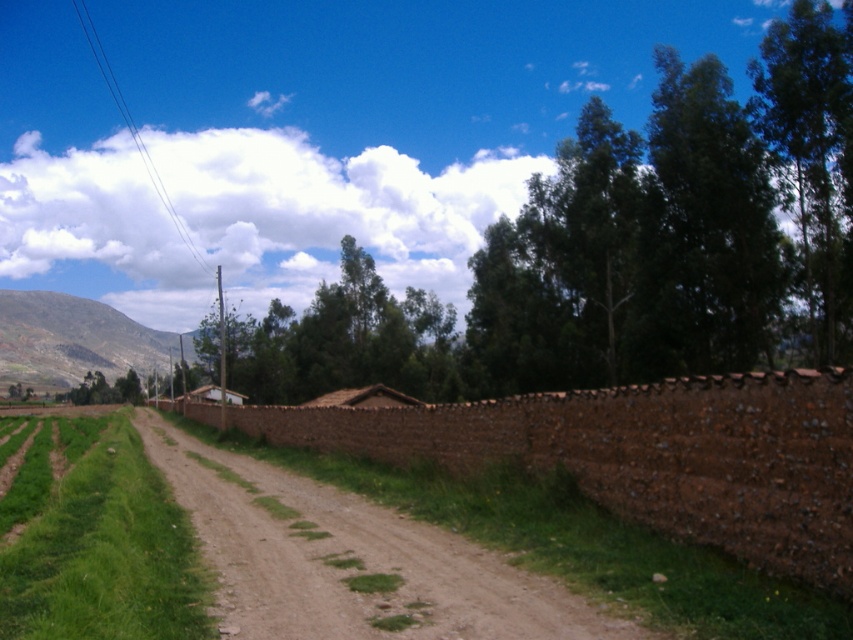
Question: Which point is farther to the camera?

Choices:
 (A) brown stone wall at center
 (B) green leafy tree at upper center

Answer: (B)

Question: Can you confirm if green leafy tree at upper center is bigger than brown stone wall at center?

Choices:
 (A) yes
 (B) no

Answer: (A)

Question: Does green leafy tree at upper center lie in front of brown stone wall at center?

Choices:
 (A) no
 (B) yes

Answer: (A)

Question: Does green leafy tree at upper center appear under brown stone wall at center?

Choices:
 (A) no
 (B) yes

Answer: (A)

Question: Which of the following is the farthest from the observer?

Choices:
 (A) (310, 323)
 (B) (399, 417)

Answer: (A)